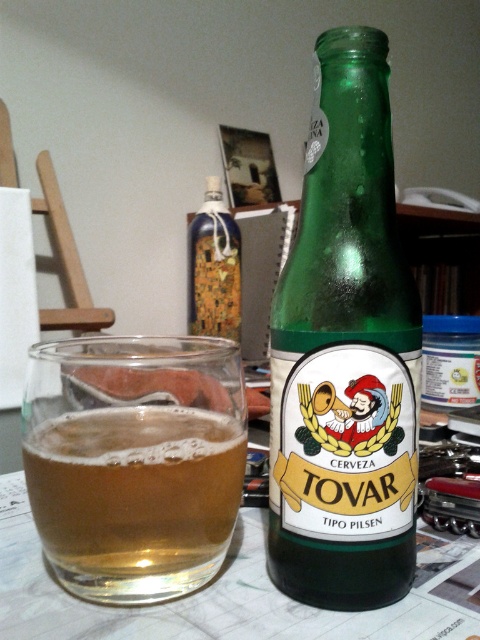
Does transparent glass at center have a lesser height compared to blue glass bottle at center?

Indeed, transparent glass at center has a lesser height compared to blue glass bottle at center.

Does transparent glass at center have a greater width compared to blue glass bottle at center?

No, transparent glass at center is not wider than blue glass bottle at center.

Describe the element at coordinates (134, 461) in the screenshot. I see `transparent glass at center` at that location.

Find the location of a particular element. transparent glass at center is located at coordinates (134, 461).

Can you confirm if green glass bottle at center is shorter than blue glass bottle at center?

Correct, green glass bottle at center is not as tall as blue glass bottle at center.

Is green glass bottle at center closer to camera compared to blue glass bottle at center?

Yes, it is in front of blue glass bottle at center.

From the picture: Who is more distant from viewer, (377, 276) or (208, 316)?

The point (208, 316) is behind.

I want to click on green glass bottle at center, so click(x=345, y=353).

Does green glass bottle at center have a smaller size compared to transparent glass at center?

No, green glass bottle at center is not smaller than transparent glass at center.

Does point (285, 593) come in front of point (136, 504)?

No, it is not.

The image size is (480, 640). I want to click on green glass bottle at center, so click(x=345, y=353).